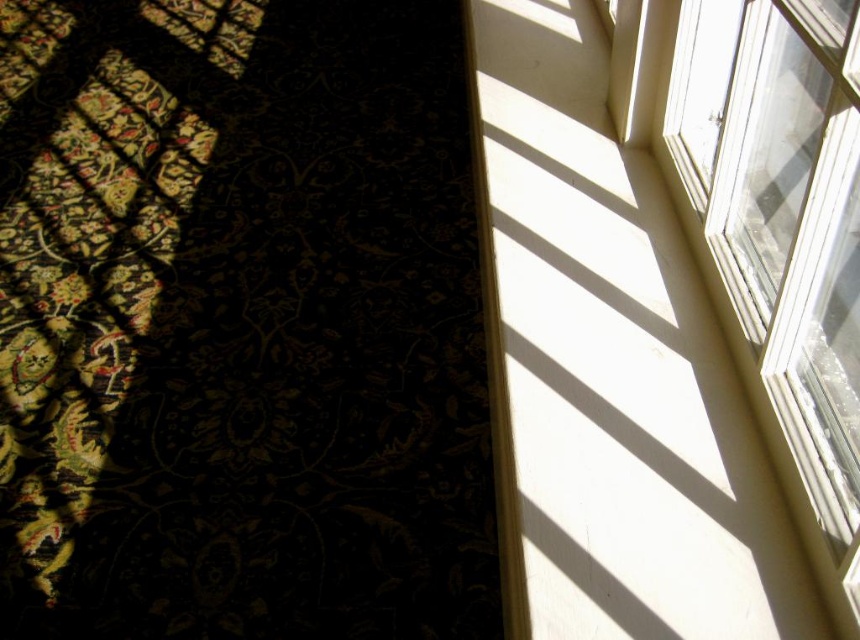
Question: Among these points, which one is farthest from the camera?

Choices:
 (A) (736, 180)
 (B) (237, 20)

Answer: (B)

Question: Does dark floral carpet at lower left appear on the left side of clear glass window at upper right?

Choices:
 (A) yes
 (B) no

Answer: (A)

Question: Which object appears farthest from the camera in this image?

Choices:
 (A) dark floral carpet at lower left
 (B) clear glass window at upper right

Answer: (A)

Question: Can you confirm if dark floral carpet at lower left is positioned below clear glass window at upper right?

Choices:
 (A) no
 (B) yes

Answer: (A)

Question: Can you confirm if dark floral carpet at lower left is thinner than clear glass window at upper right?

Choices:
 (A) no
 (B) yes

Answer: (A)